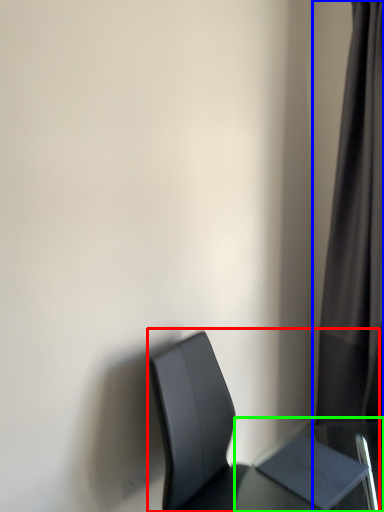
Question: Considering the real-world distances, which object is farthest from chair (highlighted by a red box)? curtain (highlighted by a blue box) or table (highlighted by a green box)?

Choices:
 (A) curtain
 (B) table

Answer: (A)